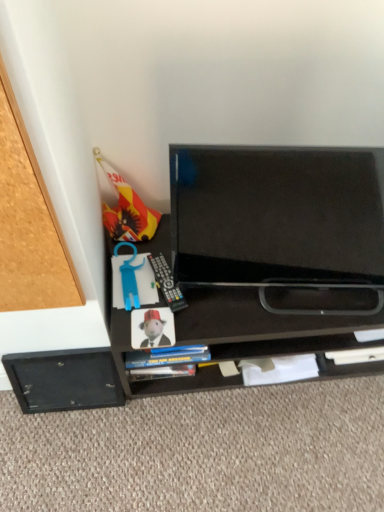
Question: Do you think matte paper book at center is within black plastic remote at lower center, or outside of it?

Choices:
 (A) inside
 (B) outside

Answer: (B)

Question: Is matte paper book at center in front of or behind black plastic remote at lower center in the image?

Choices:
 (A) front
 (B) behind

Answer: (A)

Question: Estimate the real-world distances between objects in this image. Which object is closer to the black plastic remote at lower center?

Choices:
 (A) black matte drawer at lower left
 (B) black matte tv at center
 (C) matte paper book at center
 (D) black glossy tv at center

Answer: (C)

Question: Which of these objects is positioned farthest from the black matte drawer at lower left?

Choices:
 (A) black glossy tv at center
 (B) matte paper book at center
 (C) black plastic remote at lower center
 (D) black matte tv at center

Answer: (A)